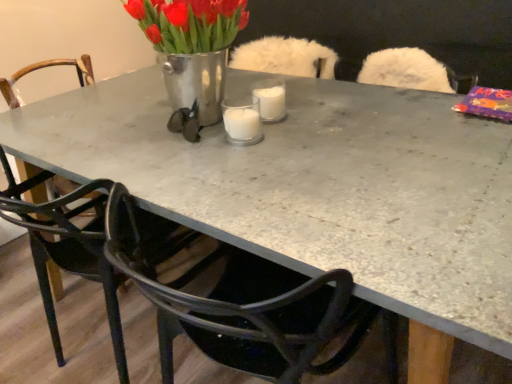
Question: From the image's perspective, is clear glass candle at center beneath metallic vase at center?

Choices:
 (A) no
 (B) yes

Answer: (B)

Question: From a real-world perspective, is clear glass candle at center located beneath metallic vase at center?

Choices:
 (A) no
 (B) yes

Answer: (B)

Question: Is clear glass candle at center far away from metallic vase at center?

Choices:
 (A) yes
 (B) no

Answer: (B)

Question: Does clear glass candle at center have a lesser width compared to metallic vase at center?

Choices:
 (A) yes
 (B) no

Answer: (A)

Question: Would you say clear glass candle at center is outside metallic vase at center?

Choices:
 (A) no
 (B) yes

Answer: (B)

Question: Can you confirm if clear glass candle at center is smaller than metallic vase at center?

Choices:
 (A) no
 (B) yes

Answer: (B)

Question: From a real-world perspective, is black metal chair at center, arranged as the first chair when viewed from the left, physically above black plastic chair at lower left, which is the first chair from right to left?

Choices:
 (A) no
 (B) yes

Answer: (B)

Question: Is black metal chair at center, acting as the second chair starting from the right, in contact with black plastic chair at lower left, positioned as the second chair in left-to-right order?

Choices:
 (A) yes
 (B) no

Answer: (B)

Question: From a real-world perspective, is black metal chair at center, arranged as the first chair when viewed from the left, under black plastic chair at lower left, positioned as the second chair in left-to-right order?

Choices:
 (A) yes
 (B) no

Answer: (B)

Question: Is black metal chair at center, acting as the second chair starting from the right, at the left side of black plastic chair at lower left, which is the first chair from right to left?

Choices:
 (A) yes
 (B) no

Answer: (A)

Question: From the image's perspective, is black metal chair at center, arranged as the first chair when viewed from the left, below black plastic chair at lower left, which is the first chair from right to left?

Choices:
 (A) no
 (B) yes

Answer: (A)

Question: Considering the relative sizes of black metal chair at center, arranged as the first chair when viewed from the left, and black plastic chair at lower left, which is the first chair from right to left, in the image provided, is black metal chair at center, arranged as the first chair when viewed from the left, smaller than black plastic chair at lower left, which is the first chair from right to left,?

Choices:
 (A) yes
 (B) no

Answer: (B)

Question: From a real-world perspective, is metallic vase at center positioned over black plastic chair at lower left, positioned as the second chair in left-to-right order, based on gravity?

Choices:
 (A) no
 (B) yes

Answer: (B)